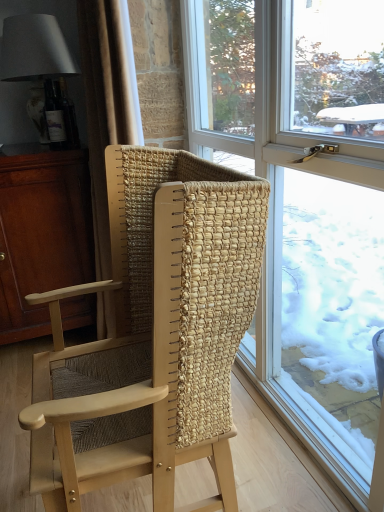
Question: Is matte brown cabinet at left turned away from beige woven curtain at left?

Choices:
 (A) no
 (B) yes

Answer: (A)

Question: Is the depth of matte brown cabinet at left less than that of beige woven curtain at left?

Choices:
 (A) yes
 (B) no

Answer: (B)

Question: Considering the relative sizes of matte brown cabinet at left and beige woven curtain at left in the image provided, is matte brown cabinet at left taller than beige woven curtain at left?

Choices:
 (A) no
 (B) yes

Answer: (A)

Question: Is the position of matte brown cabinet at left more distant than that of beige woven curtain at left?

Choices:
 (A) yes
 (B) no

Answer: (A)

Question: Considering the relative sizes of matte brown cabinet at left and beige woven curtain at left in the image provided, is matte brown cabinet at left smaller than beige woven curtain at left?

Choices:
 (A) yes
 (B) no

Answer: (B)

Question: From a real-world perspective, relative to natural woven wood chair at center, is matte white lampshade at upper left vertically above or below?

Choices:
 (A) below
 (B) above

Answer: (B)

Question: Is matte white lampshade at upper left inside the boundaries of natural woven wood chair at center, or outside?

Choices:
 (A) inside
 (B) outside

Answer: (B)

Question: Visually, is matte white lampshade at upper left positioned to the left or to the right of natural woven wood chair at center?

Choices:
 (A) right
 (B) left

Answer: (B)

Question: From their relative heights in the image, would you say matte white lampshade at upper left is taller or shorter than natural woven wood chair at center?

Choices:
 (A) tall
 (B) short

Answer: (B)

Question: Is clear glass window at center in front of or behind beige woven curtain at left in the image?

Choices:
 (A) front
 (B) behind

Answer: (A)

Question: Is clear glass window at center bigger or smaller than beige woven curtain at left?

Choices:
 (A) big
 (B) small

Answer: (A)

Question: In terms of width, does clear glass window at center look wider or thinner when compared to beige woven curtain at left?

Choices:
 (A) wide
 (B) thin

Answer: (B)

Question: From the image's perspective, is clear glass window at center located above or below beige woven curtain at left?

Choices:
 (A) above
 (B) below

Answer: (B)

Question: From the image's perspective, is natural woven wood chair at center located above or below matte brown cabinet at left?

Choices:
 (A) above
 (B) below

Answer: (B)

Question: From a real-world perspective, is natural woven wood chair at center physically located above or below matte brown cabinet at left?

Choices:
 (A) above
 (B) below

Answer: (B)